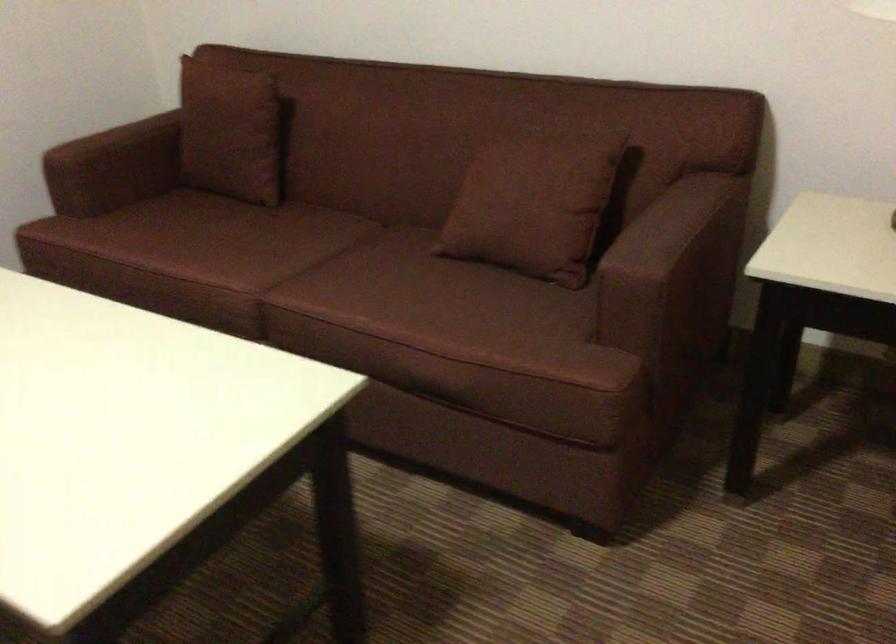
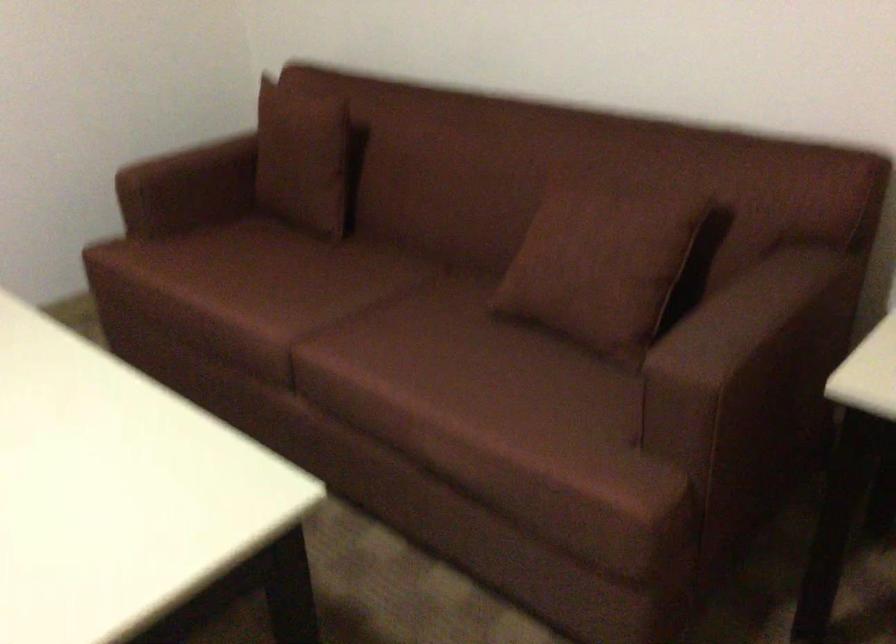
The point at (538, 196) is marked in the first image. Where is the corresponding point in the second image?

(600, 263)